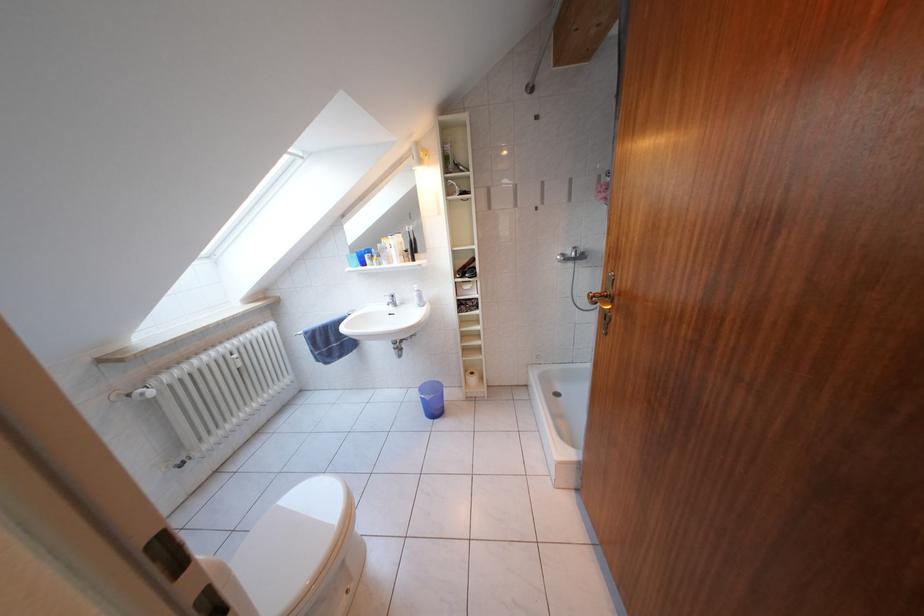
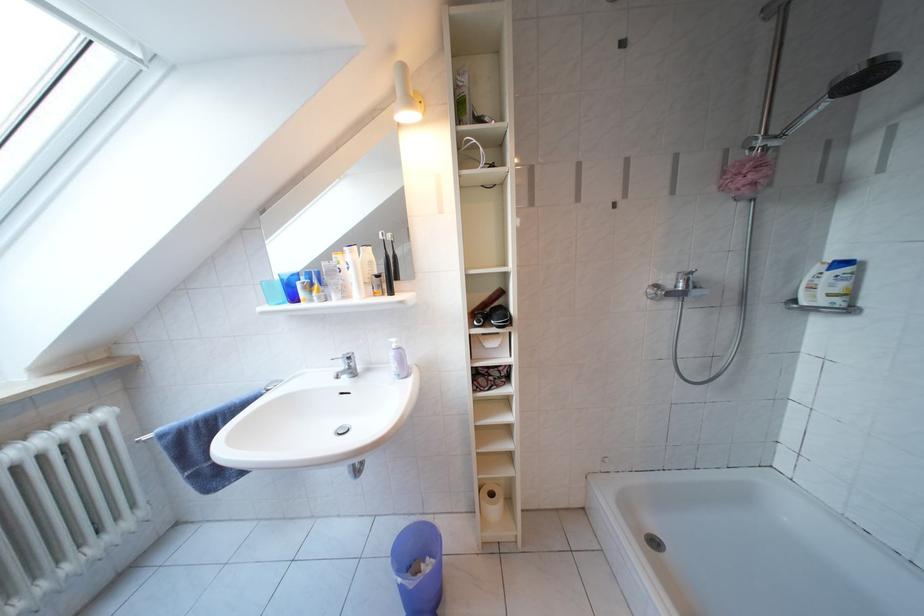
Find the pixel in the second image that matches (x=397, y=305) in the first image.

(349, 371)